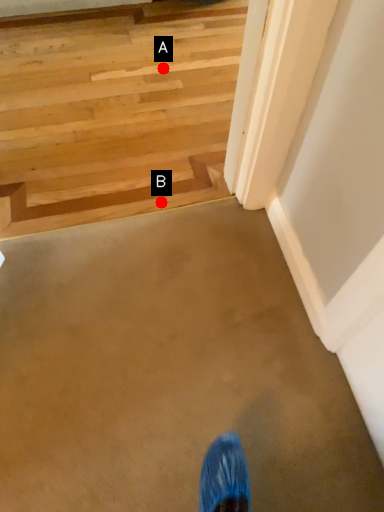
Question: Two points are circled on the image, labeled by A and B beside each circle. Which point appears closest to the camera in this image?

Choices:
 (A) A is closer
 (B) B is closer

Answer: (B)